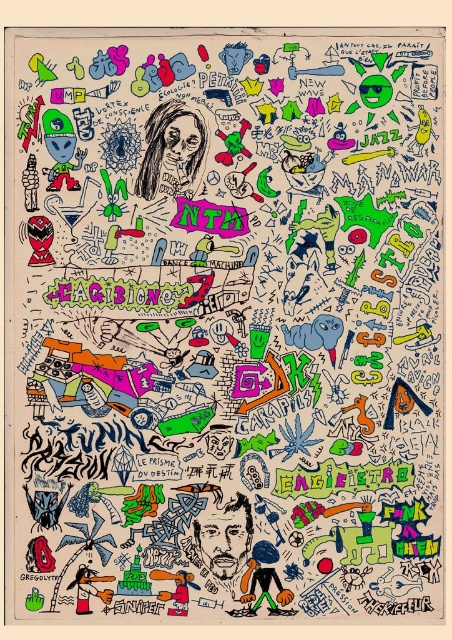
The height and width of the screenshot is (640, 452). What do you see at coordinates (173, 150) in the screenshot? I see `charcoal sketch of person at upper left` at bounding box center [173, 150].

From the picture: Who is more forward, (x=156, y=129) or (x=244, y=588)?

Positioned in front is point (x=244, y=588).

Image resolution: width=452 pixels, height=640 pixels. Describe the element at coordinates (173, 150) in the screenshot. I see `charcoal sketch of person at upper left` at that location.

In order to click on charcoal sketch of person at upper left in this screenshot , I will do `click(173, 150)`.